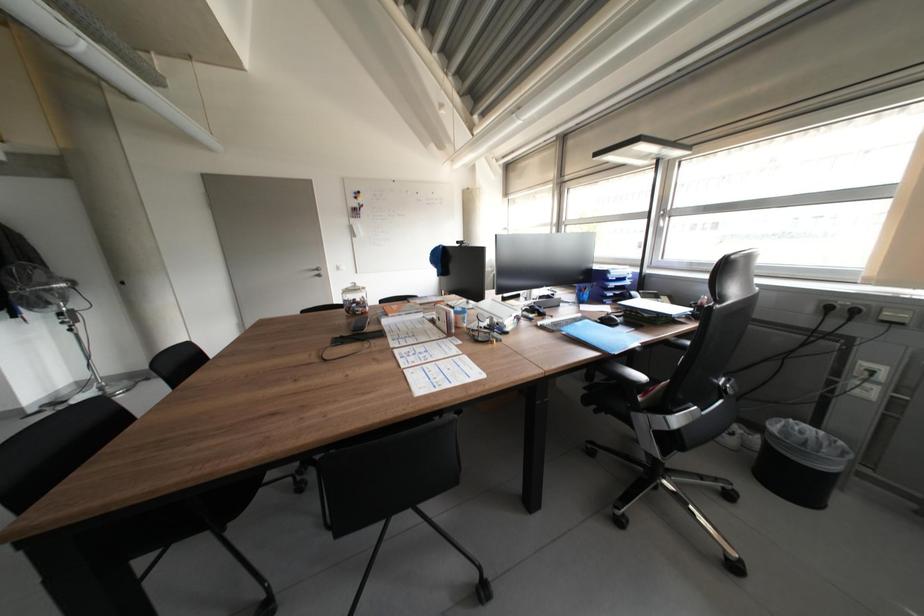
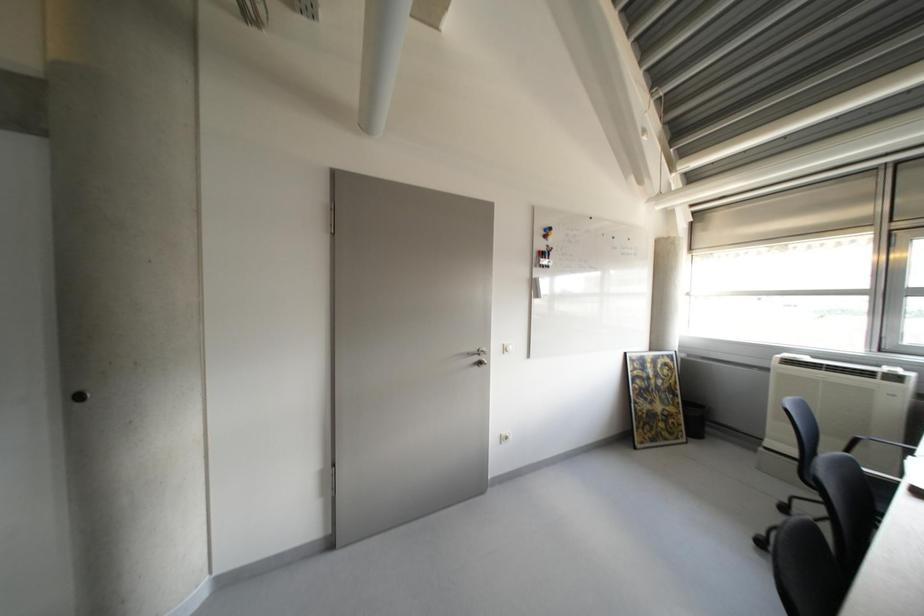
Which direction would the cameraman need to move to produce the second image?

The movement direction of the cameraman is left, forward.